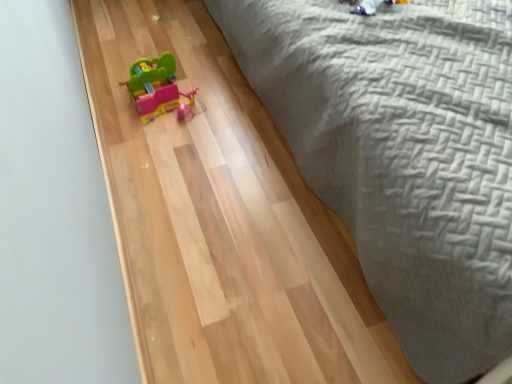
The image size is (512, 384). In order to click on vacant space behind matte plastic toy car at center in this screenshot , I will do `click(170, 52)`.